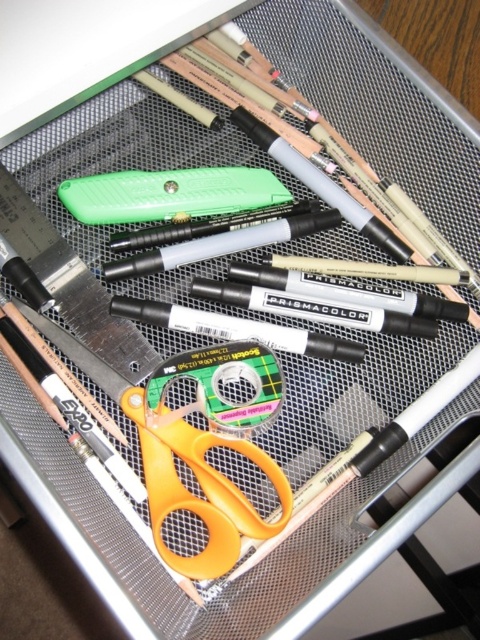
Question: Among these objects, which one is nearest to the camera?

Choices:
 (A) orange plastic scissors at center
 (B) green plastic utility knife at center

Answer: (A)

Question: Which of the following is the closest to the observer?

Choices:
 (A) (141, 444)
 (B) (82, 184)

Answer: (A)

Question: Does orange plastic scissors at center appear on the right side of green plastic utility knife at center?

Choices:
 (A) no
 (B) yes

Answer: (B)

Question: Is the position of orange plastic scissors at center less distant than that of green plastic utility knife at center?

Choices:
 (A) no
 (B) yes

Answer: (B)

Question: Which point is farther to the camera?

Choices:
 (A) orange plastic scissors at center
 (B) green plastic utility knife at center

Answer: (B)

Question: Is orange plastic scissors at center further to camera compared to green plastic utility knife at center?

Choices:
 (A) no
 (B) yes

Answer: (A)